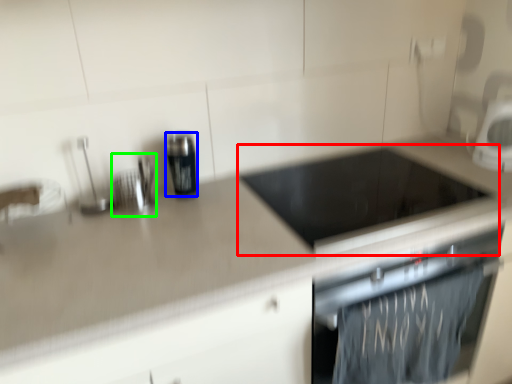
Question: Considering the real-world distances, which object is farthest from appliance (highlighted by a red box)? kitchen appliance (highlighted by a blue box) or appliance (highlighted by a green box)?

Choices:
 (A) kitchen appliance
 (B) appliance

Answer: (B)